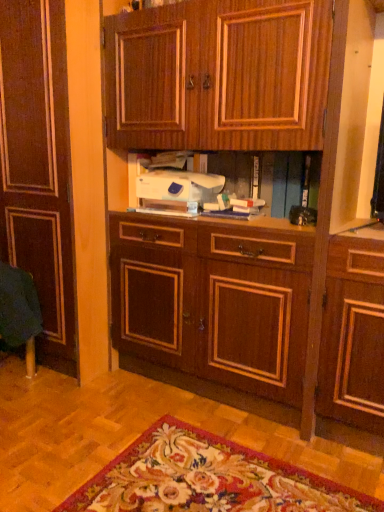
Question: Should I look upward or downward to see white plastic sewing machine at center?

Choices:
 (A) down
 (B) up

Answer: (B)